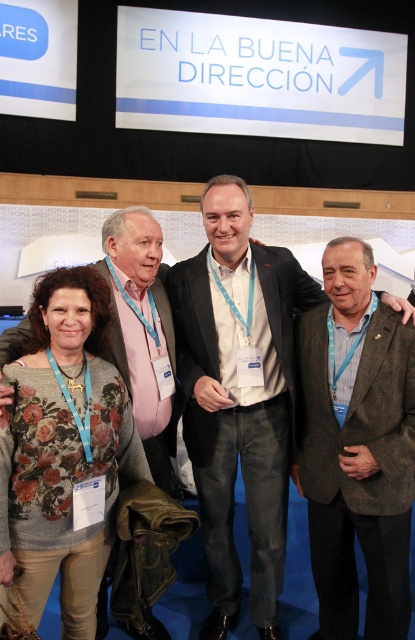
You are a photographer at the event and need to adjust the lighting to ensure both the brown woolen jacket at center and the floral sweater at lower left are well lit. Considering their heights, which one might require a higher light source to avoid shadows?

The brown woolen jacket at center has a greater height compared to the floral sweater at lower left, so it would require a higher light source to avoid shadows.

You are a photographer who needs to adjust the lighting between the light brown woolen blazer at center and the floral sweater at lower left. The minimum distance required for proper lighting is 50 centimeters. Can you confirm if the current distance allows for proper lighting?

The light brown woolen blazer at center is 56.75 centimeters from the floral sweater at lower left, which exceeds the minimum 50 centimeter requirement. Therefore, the current distance allows for proper lighting between them.

You are a photographer standing at the center of the scene. You need to adjust the camera focus so that both the brown woolen jacket at center and the large screen behind them are in focus. What is the minimum distance you should set for the depth of field?

The minimum distance for the depth of field should be set to at least 6.20 feet to ensure both the brown woolen jacket at center and the large screen behind them are in focus.